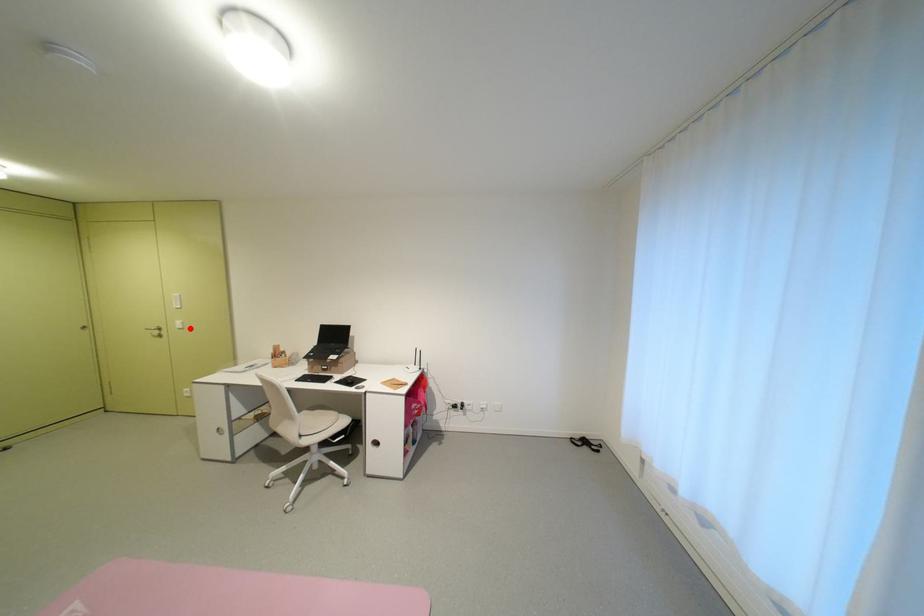
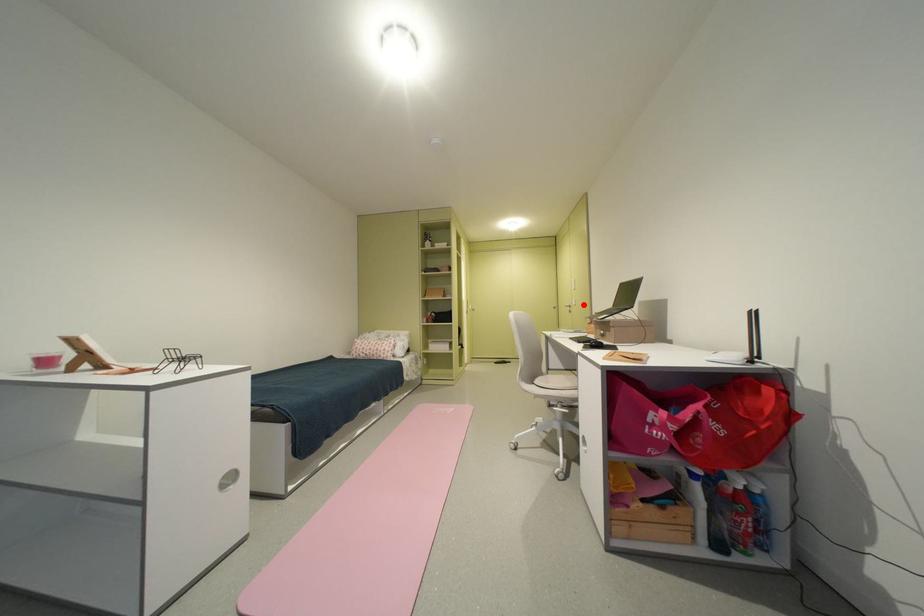
In the scene shown: I am providing you with two images of the same scene from different viewpoints. A red point is marked on the first image and another point is marked on the second image. Is the marked point in image1 the same physical position as the marked point in image2?

Yes